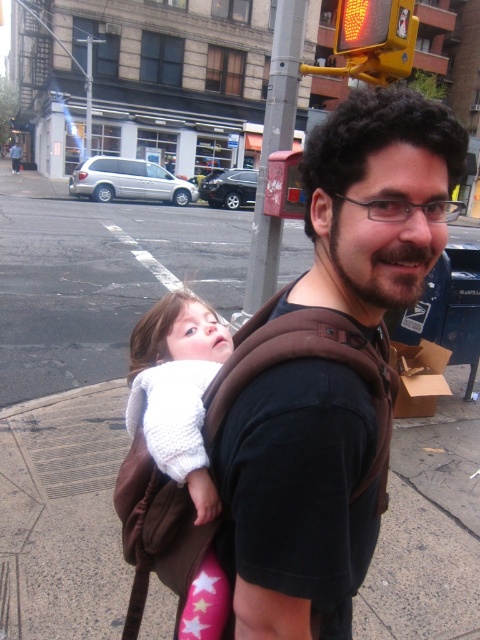
You are a delivery person who needs to pass through a narrow doorway that is only 1 meter wide. You see the brown fabric carrier at center and the white knitted sweater at center in the scene. Which object is wider and might block your path?

The brown fabric carrier at center might be wider than the white knitted sweater at center, so it could potentially block your path through the narrow doorway.

You are a photographer standing on the sidewalk observing the scene. You notice the brown fabric carrier at center and the white knitted sweater at center. Which object is positioned higher in the image?

The brown fabric carrier at center is above the white knitted sweater at center, so it is positioned higher in the image.